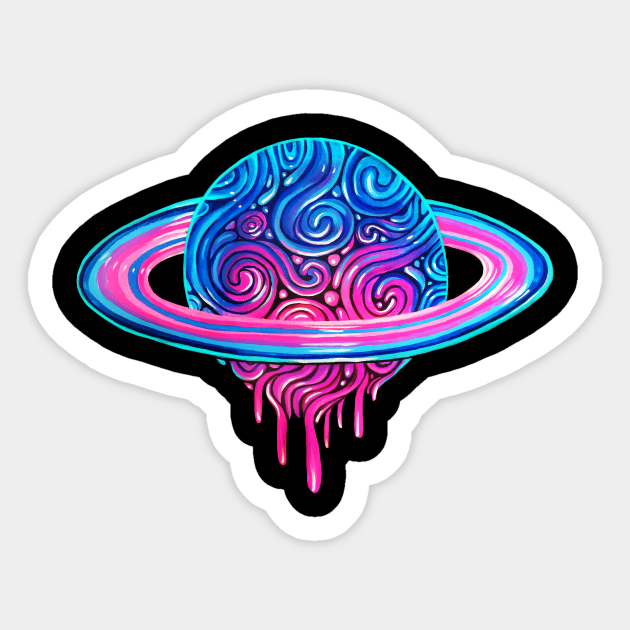
This screenshot has width=630, height=630. Find the location of `art`. art is located at coordinates (297, 260).